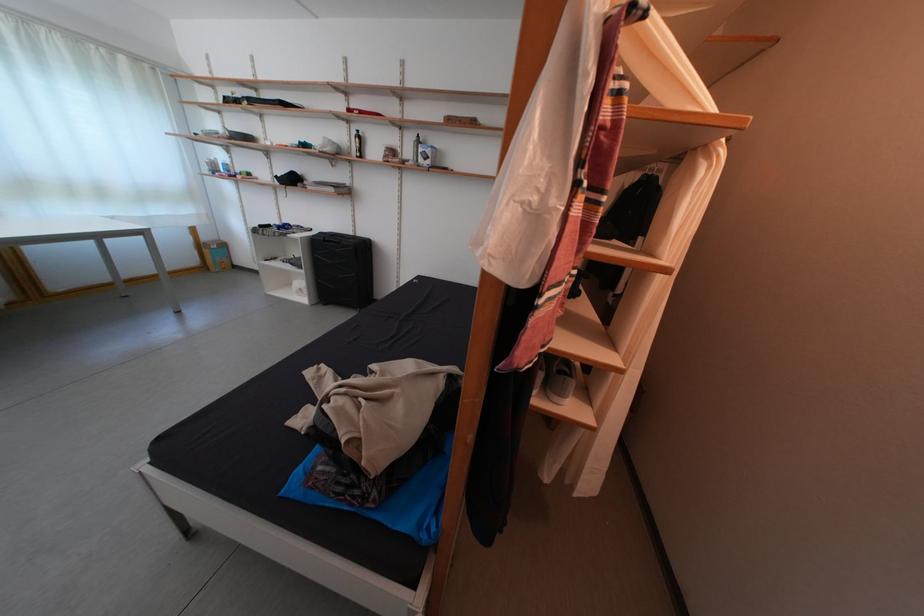
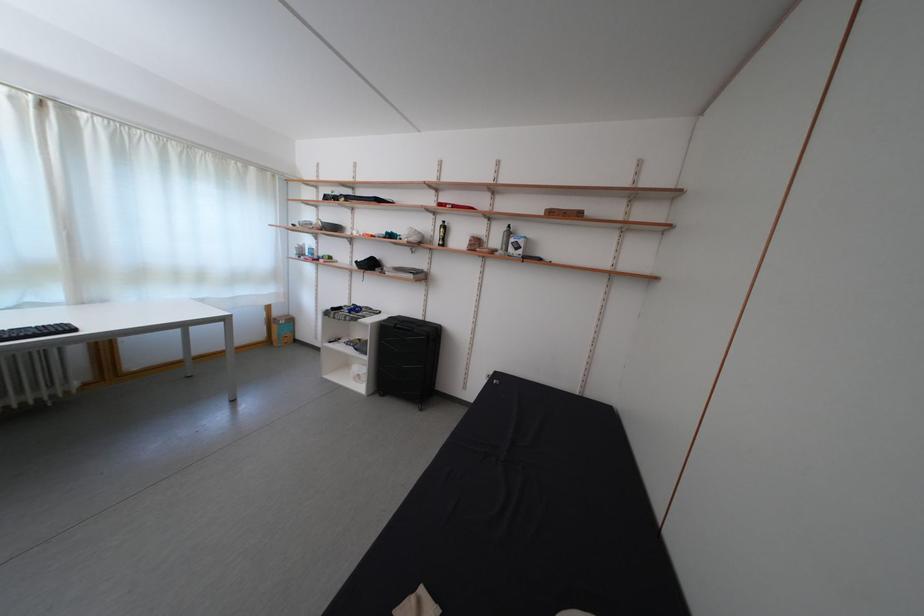
Find the pixel in the second image that matches (x=213, y=244) in the first image.

(285, 320)